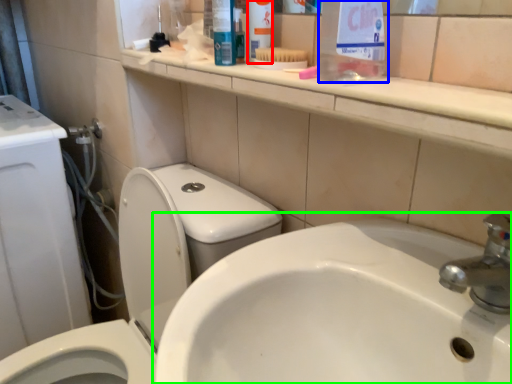
Question: Considering the real-world distances, which object is closest to toiletry (highlighted by a red box)? cleaning product (highlighted by a blue box) or sink (highlighted by a green box).

Choices:
 (A) cleaning product
 (B) sink

Answer: (A)